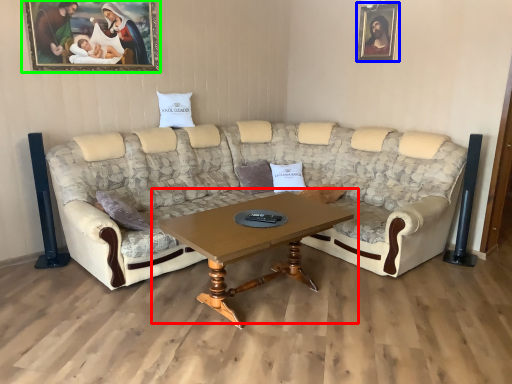
Question: Which object is the farthest from coffee table (highlighted by a red box)? Choose among these: picture frame (highlighted by a blue box) or picture frame (highlighted by a green box).

Choices:
 (A) picture frame
 (B) picture frame

Answer: (A)